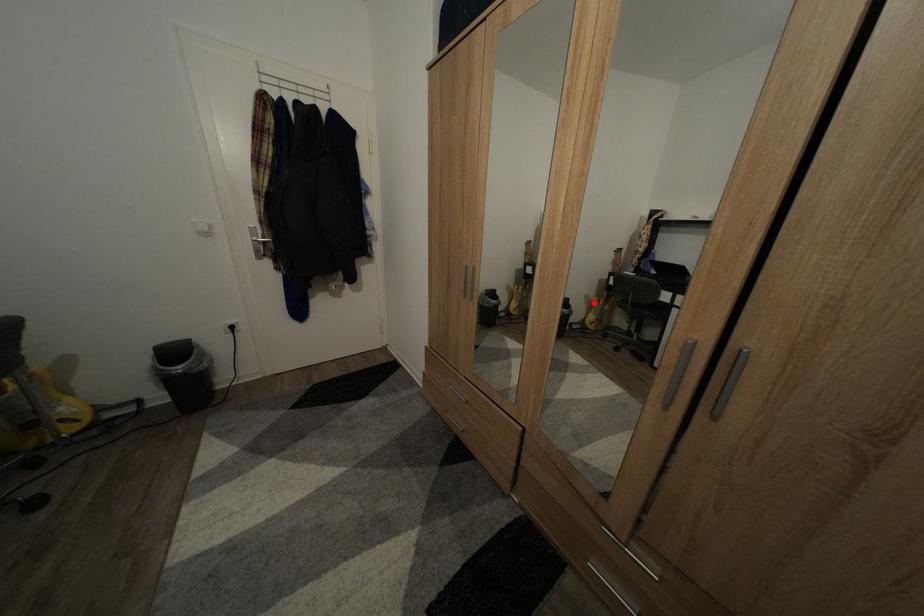
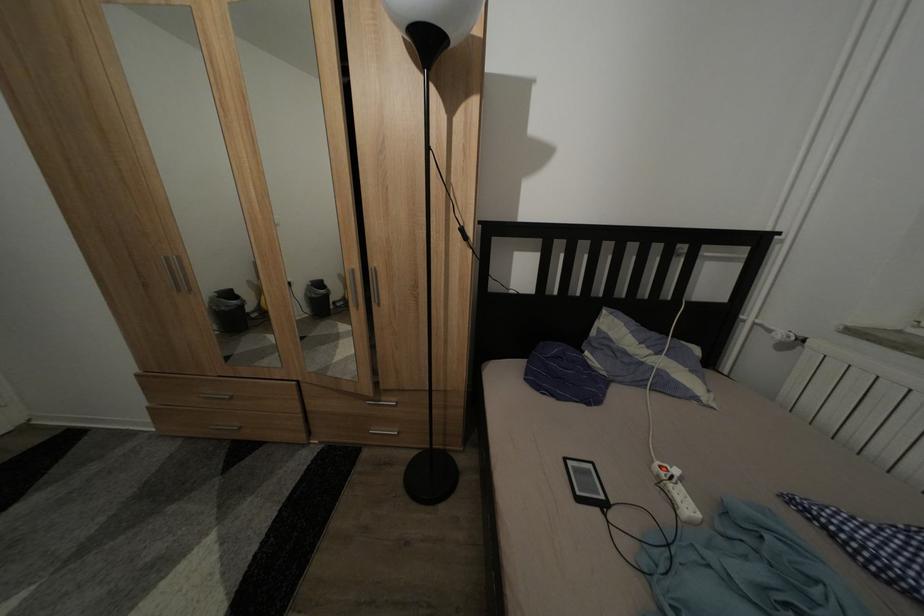
Find the pixel in the second image that matches the highlighted location in the first image.

(347, 282)